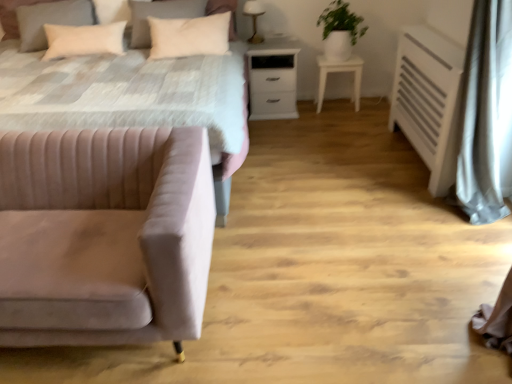
Question: Considering the relative sizes of beige velvet pillow at upper left, arranged as the 1th pillow when viewed from the left, and metallic gold table lamp at upper center in the image provided, is beige velvet pillow at upper left, arranged as the 1th pillow when viewed from the left, thinner than metallic gold table lamp at upper center?

Choices:
 (A) no
 (B) yes

Answer: (A)

Question: Considering the relative positions of beige velvet pillow at upper left, arranged as the 1th pillow when viewed from the left, and metallic gold table lamp at upper center in the image provided, is beige velvet pillow at upper left, arranged as the 1th pillow when viewed from the left, to the right of metallic gold table lamp at upper center from the viewer's perspective?

Choices:
 (A) yes
 (B) no

Answer: (B)

Question: Does beige velvet pillow at upper left, arranged as the third pillow when viewed from the right, come in front of metallic gold table lamp at upper center?

Choices:
 (A) yes
 (B) no

Answer: (A)

Question: Considering the relative sizes of beige velvet pillow at upper left, arranged as the third pillow when viewed from the right, and metallic gold table lamp at upper center in the image provided, is beige velvet pillow at upper left, arranged as the third pillow when viewed from the right, bigger than metallic gold table lamp at upper center?

Choices:
 (A) yes
 (B) no

Answer: (A)

Question: From a real-world perspective, is beige velvet pillow at upper left, arranged as the third pillow when viewed from the right, located beneath metallic gold table lamp at upper center?

Choices:
 (A) yes
 (B) no

Answer: (B)

Question: From the image's perspective, would you say beige velvet pillow at upper left, arranged as the 1th pillow when viewed from the left, is shown under metallic gold table lamp at upper center?

Choices:
 (A) no
 (B) yes

Answer: (B)

Question: Is green matte plant at upper right positioned far away from white matte nightstand at center?

Choices:
 (A) no
 (B) yes

Answer: (A)

Question: Is green matte plant at upper right wider than white matte nightstand at center?

Choices:
 (A) no
 (B) yes

Answer: (A)

Question: Is green matte plant at upper right thinner than white matte nightstand at center?

Choices:
 (A) yes
 (B) no

Answer: (A)

Question: Does green matte plant at upper right appear on the right side of white matte nightstand at center?

Choices:
 (A) yes
 (B) no

Answer: (A)

Question: From a real-world perspective, is green matte plant at upper right positioned over white matte nightstand at center based on gravity?

Choices:
 (A) no
 (B) yes

Answer: (B)

Question: From the image's perspective, is green matte plant at upper right on top of white matte nightstand at center?

Choices:
 (A) yes
 (B) no

Answer: (A)

Question: Can you confirm if white soft pillow at upper left, marked as the 1th pillow in a right-to-left arrangement, is smaller than velvet pink couch at lower left?

Choices:
 (A) no
 (B) yes

Answer: (B)